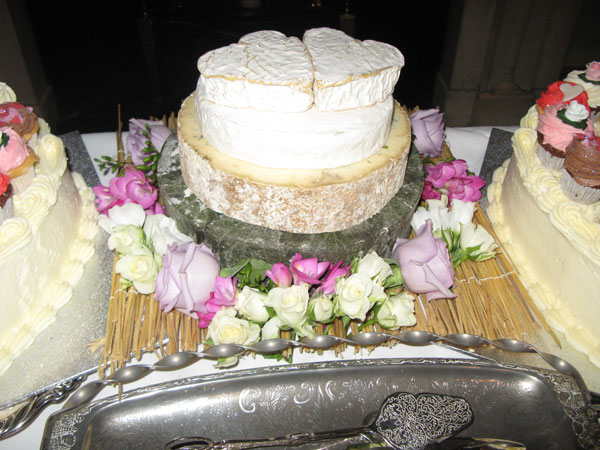
Identify the location of walls. Image resolution: width=600 pixels, height=450 pixels. (474, 69), (30, 63).